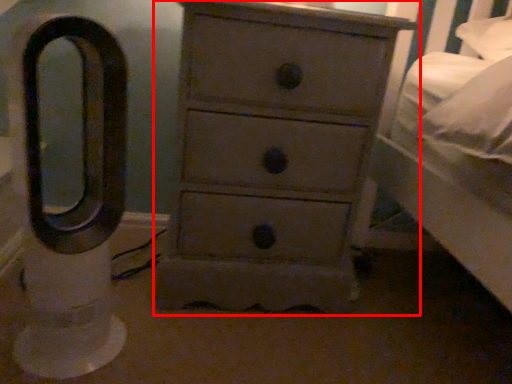
Question: Where is chest of drawers (annotated by the red box) located in relation to swivel chair in the image?

Choices:
 (A) right
 (B) left

Answer: (A)